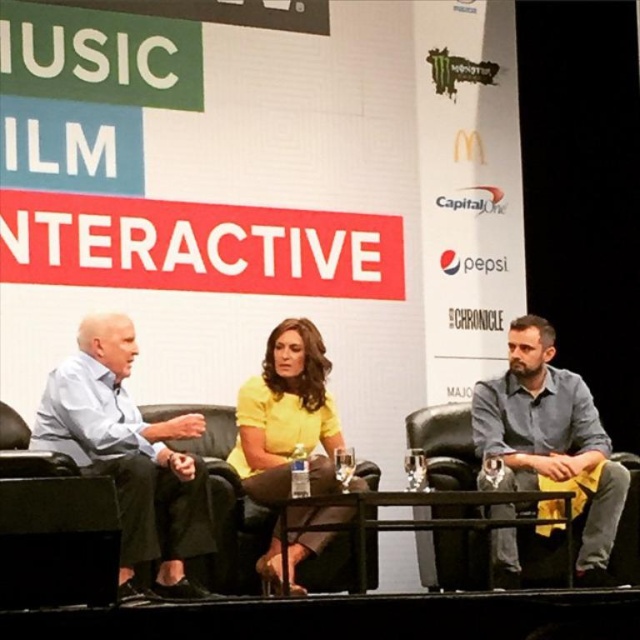
Question: Does gray cotton shirt at right appear on the left side of yellow matte shirt at center?

Choices:
 (A) no
 (B) yes

Answer: (A)

Question: Which point is farther from the camera taking this photo?

Choices:
 (A) (81, 417)
 (B) (268, 403)
 (C) (595, 547)

Answer: (B)

Question: Which point appears farthest from the camera in this image?

Choices:
 (A) (161, 440)
 (B) (260, 481)

Answer: (B)

Question: Does light blue shirt at left appear on the right side of gray cotton shirt at right?

Choices:
 (A) yes
 (B) no

Answer: (B)

Question: Is gray cotton shirt at right further to the viewer compared to yellow matte shirt at center?

Choices:
 (A) no
 (B) yes

Answer: (B)

Question: Considering the real-world distances, which object is farthest from the light blue shirt at left?

Choices:
 (A) yellow matte shirt at center
 (B) gray cotton shirt at right

Answer: (B)